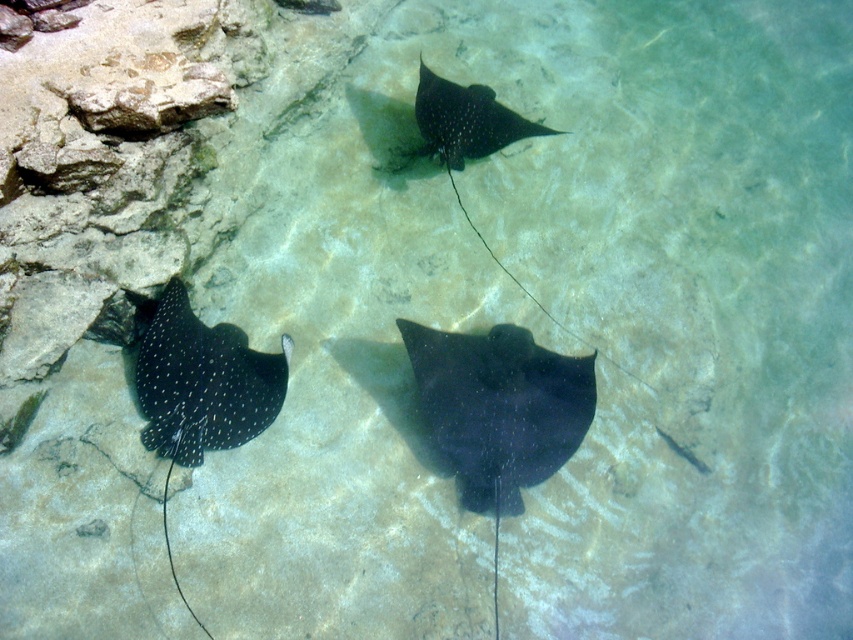
Which of these two, black glossy stingray at center or black dotted stingray at lower left, stands taller?

black glossy stingray at center

Does point (485, 417) come behind point (241, 330)?

No, it is not.

Identify the location of black glossy stingray at center. (498, 406).

Identify the location of black glossy stingray at center. (498, 406).

Who is more distant from viewer, (521, 417) or (439, 140)?

Positioned behind is point (439, 140).

You are a GUI agent. You are given a task and a screenshot of the screen. Output one action in this format:
    pyautogui.click(x=<x>, y=<y>)
    Task: Click on the black glossy stingray at center
    
    Given the screenshot: What is the action you would take?
    point(498,406)

Based on the photo, which of these two, black dotted stingray at lower left or black glossy stingray at upper center, stands shorter?

black glossy stingray at upper center

What do you see at coordinates (200, 378) in the screenshot?
I see `black dotted stingray at lower left` at bounding box center [200, 378].

I want to click on black dotted stingray at lower left, so click(x=200, y=378).